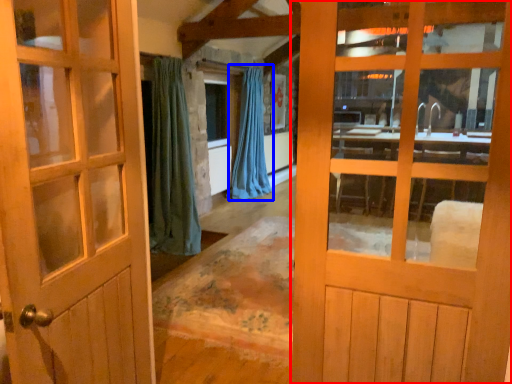
Question: Which object appears closest to the camera in this image, door (highlighted by a red box) or curtain (highlighted by a blue box)?

Choices:
 (A) door
 (B) curtain

Answer: (A)